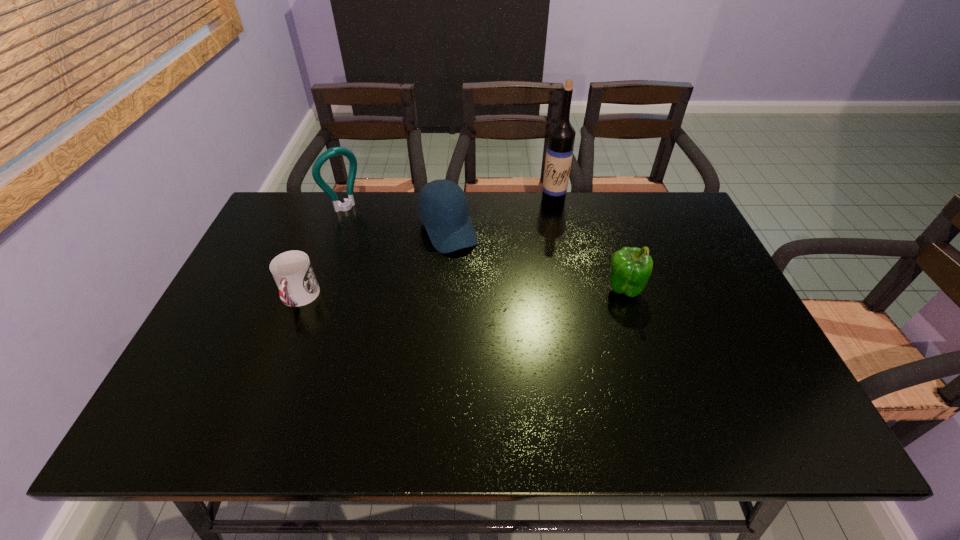
I want to click on vacant spot on the desktop that is between the shortest object and the rightmost object and is positioned on the label of the fourth object from left to right, so click(484, 293).

The height and width of the screenshot is (540, 960). I want to click on free space on the desktop that is between the shortest object and the third tallest object and is positioned on the front-facing side of the third object from left to right, so click(484, 293).

What are the coordinates of `vacant spot on the desktop that is between the cup and the third shortest object and is positioned at the jaws of the second tallest object` in the screenshot? It's located at (427, 295).